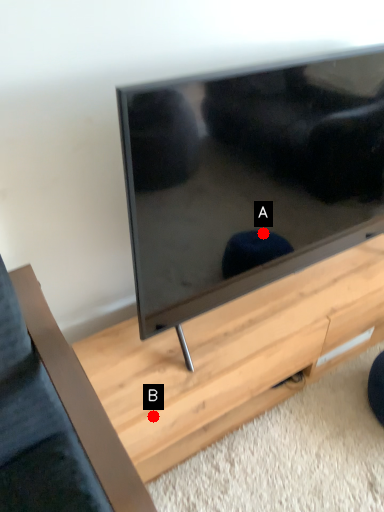
Question: Two points are circled on the image, labeled by A and B beside each circle. Which of the following is the farthest from the observer?

Choices:
 (A) A is further
 (B) B is further

Answer: (A)